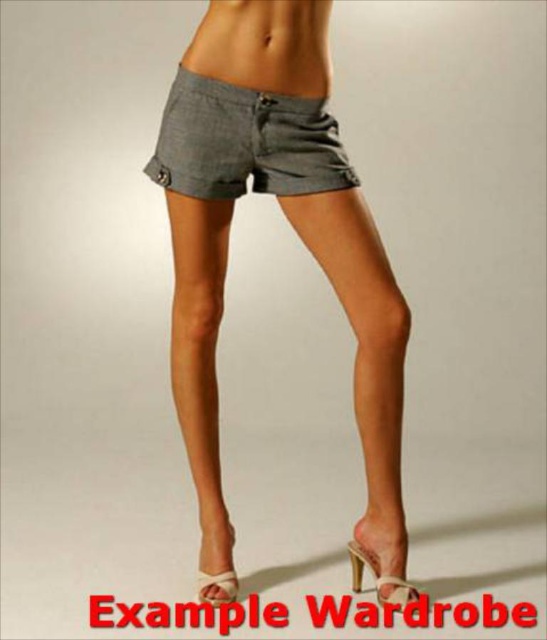
You are a fashion designer analyzing an outfit. The image shows a person wearing two items. One is a pair of gray shorts at the center. The other is a pair of high heels. Which item is located at the coordinate point [299,237]?

The point at coordinate [299,237] indicates the location of the matte gray shorts at center.

You are a fashion designer analyzing the placement of the matte gray shorts at center in an outfit. Based on the coordinates provided, is the shorts positioned closer to the top or bottom half of the image?

The matte gray shorts at center is located at point (299, 237). Since the y coordinate is 0.548, which is above the midpoint of 0.5, the shorts are positioned closer to the bottom half of the image.

You are a photographer adjusting the camera focus. You notice two points in the image labeled as point (293, 60) and point (171, 96). Which point should you focus on first if you want to ensure the closest object is sharp?

Point (293, 60) is in front of point (171, 96), so you should focus on point (293, 60) first to capture the closest object sharply.